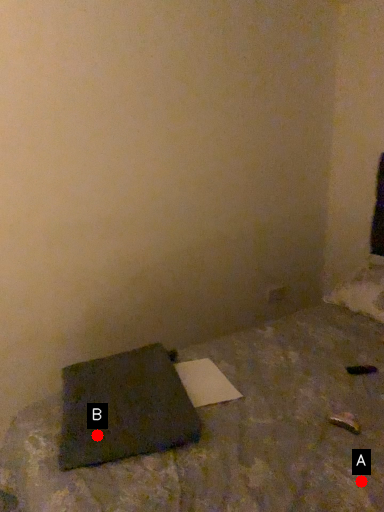
Question: Two points are circled on the image, labeled by A and B beside each circle. Which point is farther from the camera taking this photo?

Choices:
 (A) A is further
 (B) B is further

Answer: (B)